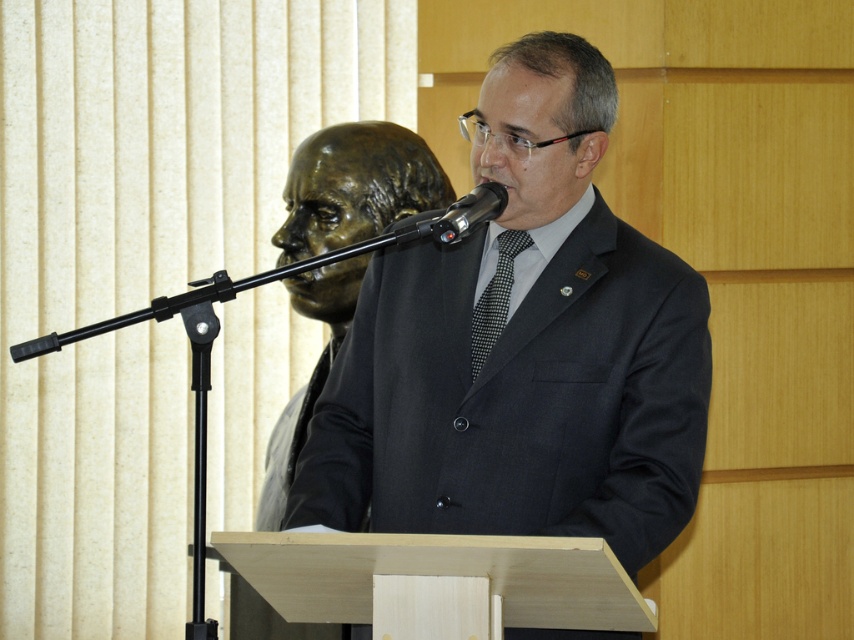
You are a photographer setting up for a speech event. You notice two points marked in the scene. The first point is at coordinate point (363, 515), and the second is at point (498, 314). From the speaker standing at the podium, which point is closer to the front of the stage?

Point (498, 314) is closer to the front of the stage because it is in front of point (363, 515), which is behind it.

In the formal setting described, there is a bronze statue at left and a black metallic microphone at center. Which object is taller?

The bronze statue at left is taller than the black metallic microphone at center.